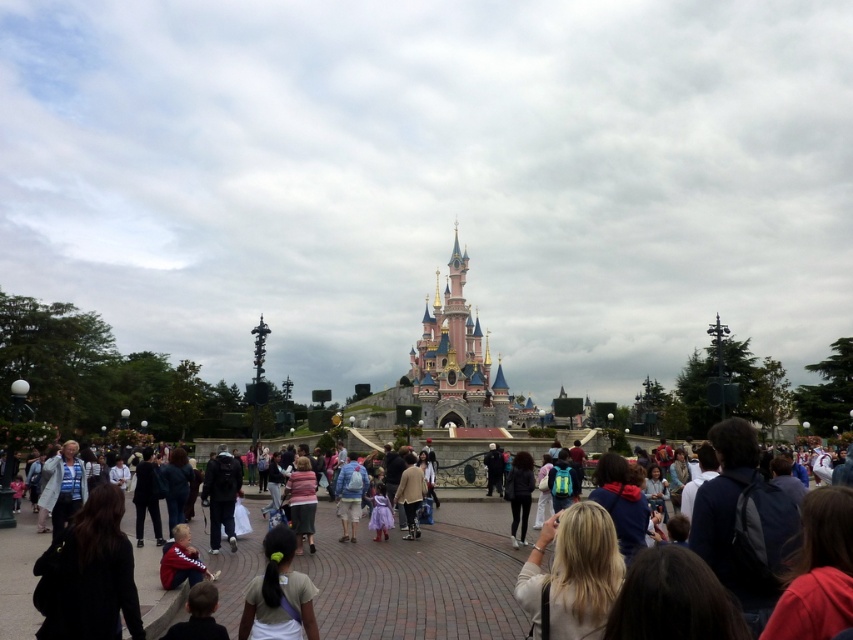
Question: Can you confirm if blonde hair at center is smaller than striped sweater at center?

Choices:
 (A) yes
 (B) no

Answer: (B)

Question: Can you confirm if striped sweater at center is thinner than light brown leather jacket at center?

Choices:
 (A) no
 (B) yes

Answer: (A)

Question: Among these objects, which one is farthest from the camera?

Choices:
 (A) red fabric headband at center
 (B) light brown hair at center

Answer: (B)

Question: Which object appears closest to the camera in this image?

Choices:
 (A) red fleece jacket at center
 (B) light brown hair at center
 (C) red fabric headband at center

Answer: (C)

Question: Which object is closer to the camera taking this photo?

Choices:
 (A) striped sweater at center
 (B) red fleece jacket at center
 (C) red fabric headband at center
 (D) black fabric at center

Answer: (C)

Question: Is red fabric headband at center to the right of black matte jacket at center from the viewer's perspective?

Choices:
 (A) no
 (B) yes

Answer: (B)